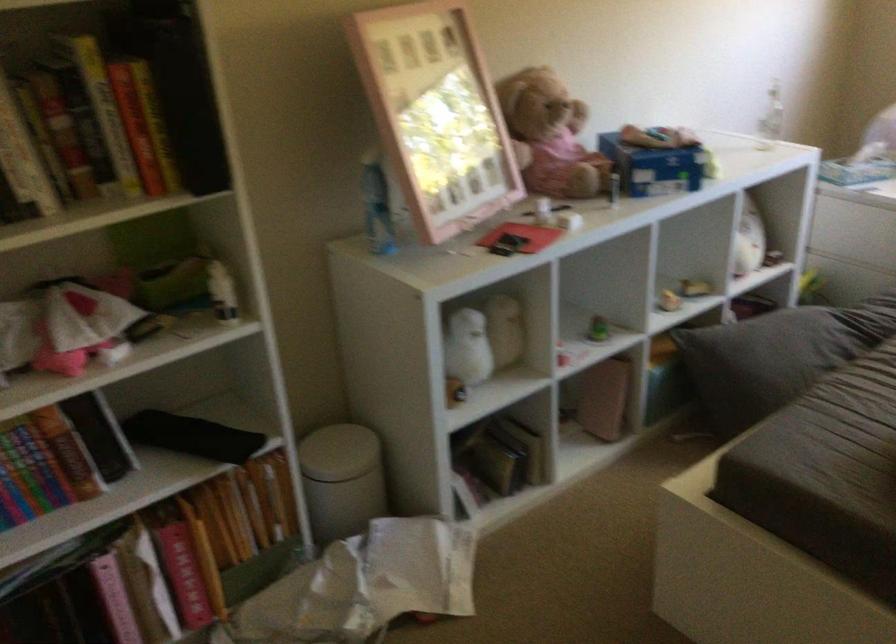
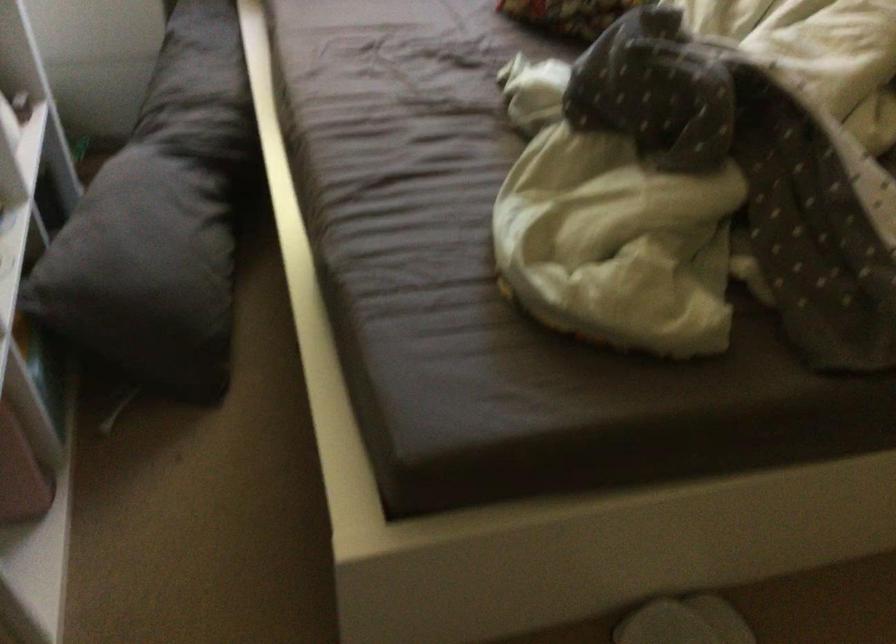
Based on the continuous images, in which direction is the camera rotating?

The rotation direction of the camera is right-down.